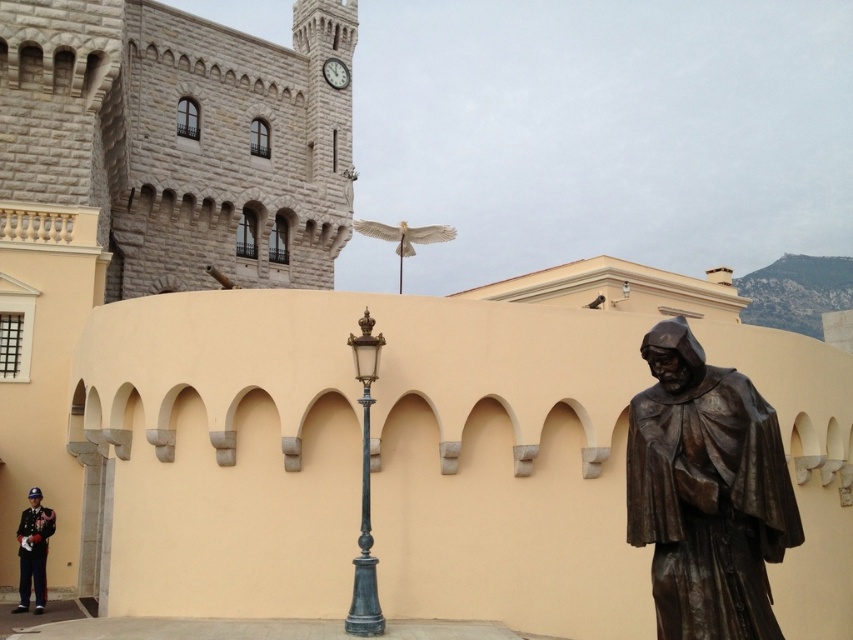
You are a visitor standing in front of the beige wall with arches and want to take a photo that includes both the shiny black uniform at lower left and the white stone clock at upper center. Which object should you adjust your camera angle to focus on first to ensure both are in frame?

Since the shiny black uniform at lower left is below the white stone clock at upper center, you should adjust your camera angle to focus on the white stone clock at upper center first, then ensure the shiny black uniform at lower left is visible below it in the frame.

You are an architect designing a new building and want to ensure that the bronze statue at right and the white stone clock at upper center are visible from the entrance. Given their sizes, which object will appear taller when viewed from the entrance?

The bronze statue at right is taller than the white stone clock at upper center, so it will appear taller when viewed from the entrance.